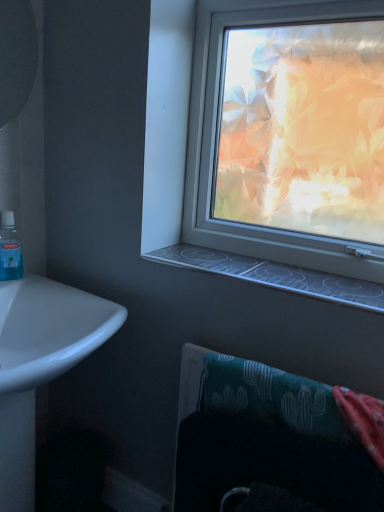
Question: From the image's perspective, is white glossy sink at lower left above or below clear plastic window sill at center?

Choices:
 (A) below
 (B) above

Answer: (A)

Question: Visually, is white glossy sink at lower left positioned to the left or to the right of clear plastic window sill at center?

Choices:
 (A) left
 (B) right

Answer: (A)

Question: Estimate the real-world distances between objects in this image. Which object is closer to the blue translucent mouthwash at left?

Choices:
 (A) teal fabric towel at lower right
 (B) clear plastic window sill at center
 (C) white glossy sink at lower left

Answer: (C)

Question: Estimate the real-world distances between objects in this image. Which object is farther from the teal fabric towel at lower right?

Choices:
 (A) blue translucent mouthwash at left
 (B) white glossy sink at lower left
 (C) clear plastic window sill at center

Answer: (A)